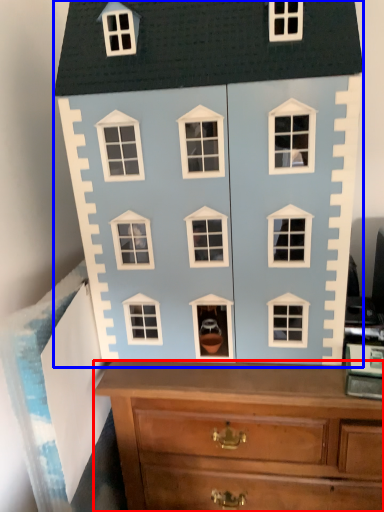
Question: Which object appears farthest to the camera in this image, chest of drawers (highlighted by a red box) or toy (highlighted by a blue box)?

Choices:
 (A) chest of drawers
 (B) toy

Answer: (A)